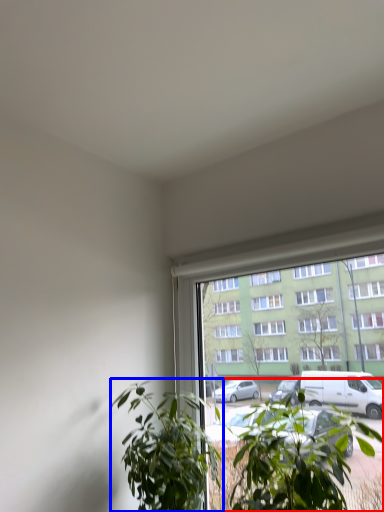
Question: Which point is further to the camera, houseplant (highlighted by a red box) or houseplant (highlighted by a blue box)?

Choices:
 (A) houseplant
 (B) houseplant

Answer: (B)